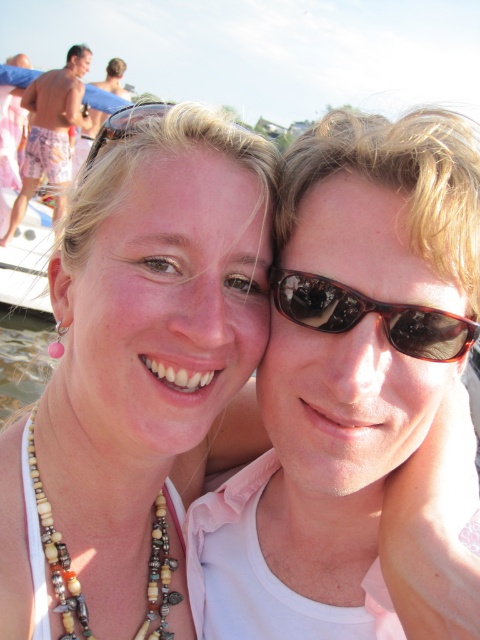
Question: Considering the relative positions of beige and brown beads necklace at lower left and matte black sunglasses at upper left in the image provided, where is beige and brown beads necklace at lower left located with respect to matte black sunglasses at upper left?

Choices:
 (A) left
 (B) right

Answer: (A)

Question: Is shiny pink shorts at left above matte black sunglasses at upper left?

Choices:
 (A) no
 (B) yes

Answer: (B)

Question: Which point is farther to the camera?

Choices:
 (A) (166, 618)
 (B) (165, 108)
 (C) (399, 314)

Answer: (A)

Question: Which of the following is the closest to the observer?

Choices:
 (A) (465, 342)
 (B) (52, 132)
 (C) (46, 524)
 (D) (101, 145)

Answer: (A)

Question: Among these points, which one is farthest from the camera?

Choices:
 (A) (33, 422)
 (B) (109, 115)
 (C) (299, 304)

Answer: (B)

Question: Is brown reflective sunglasses at center positioned before matte black sunglasses at upper left?

Choices:
 (A) no
 (B) yes

Answer: (B)